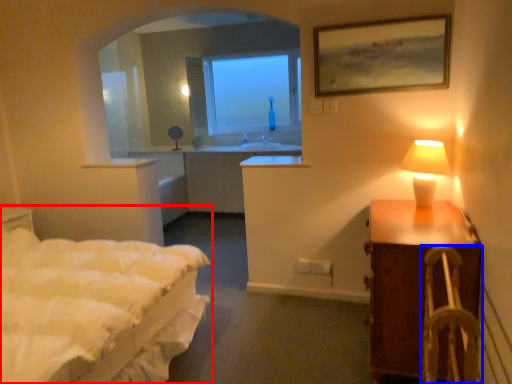
Question: Which of the following is the farthest to the observer, bed (highlighted by a red box) or armchair (highlighted by a blue box)?

Choices:
 (A) bed
 (B) armchair

Answer: (B)